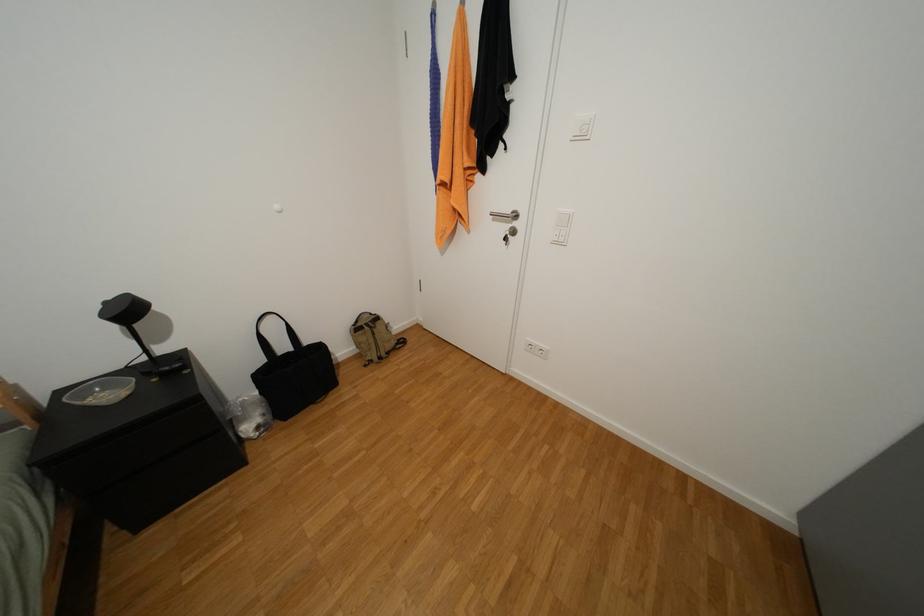
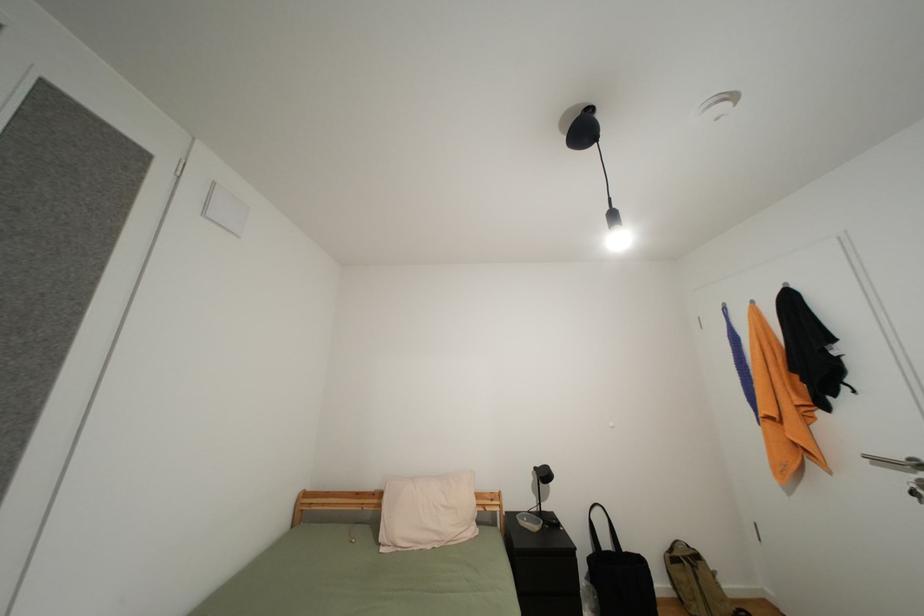
In the scene shown: First-person continuous shooting, in which direction is the camera rotating?

The camera's rotation is toward left-up.